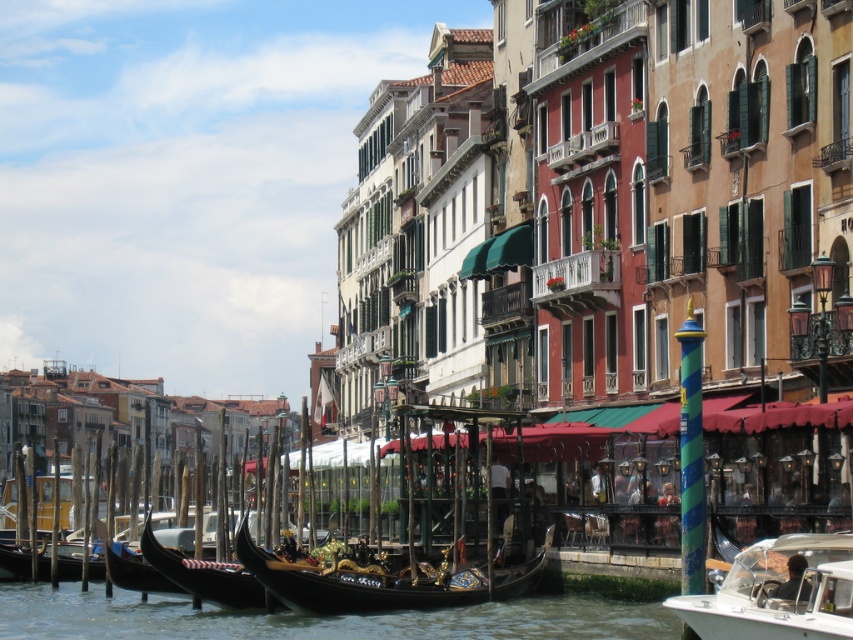
Question: Which object is the closest to the white glossy motorboat at lower right?

Choices:
 (A) polished wood gondola at center
 (B) black polished gondola at center

Answer: (B)

Question: Observing the image, what is the correct spatial positioning of black polished gondola at center in reference to polished wood gondola at center?

Choices:
 (A) below
 (B) above

Answer: (B)

Question: Is white glossy motorboat at lower right positioned behind black polished gondola at center?

Choices:
 (A) yes
 (B) no

Answer: (B)

Question: Can you confirm if black polished gondola at center is positioned to the left of polished wood gondola at center?

Choices:
 (A) yes
 (B) no

Answer: (B)

Question: Estimate the real-world distances between objects in this image. Which object is closer to the polished wood gondola at center?

Choices:
 (A) white glossy motorboat at lower right
 (B) black polished gondola at center

Answer: (B)

Question: Which point is closer to the camera?

Choices:
 (A) polished wood gondola at center
 (B) white glossy motorboat at lower right
 (C) black polished gondola at center

Answer: (B)